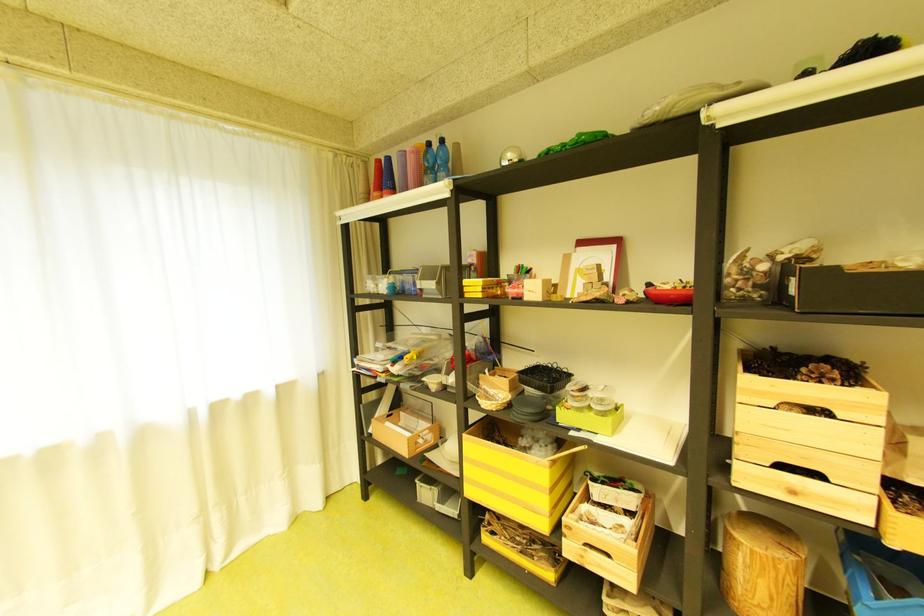
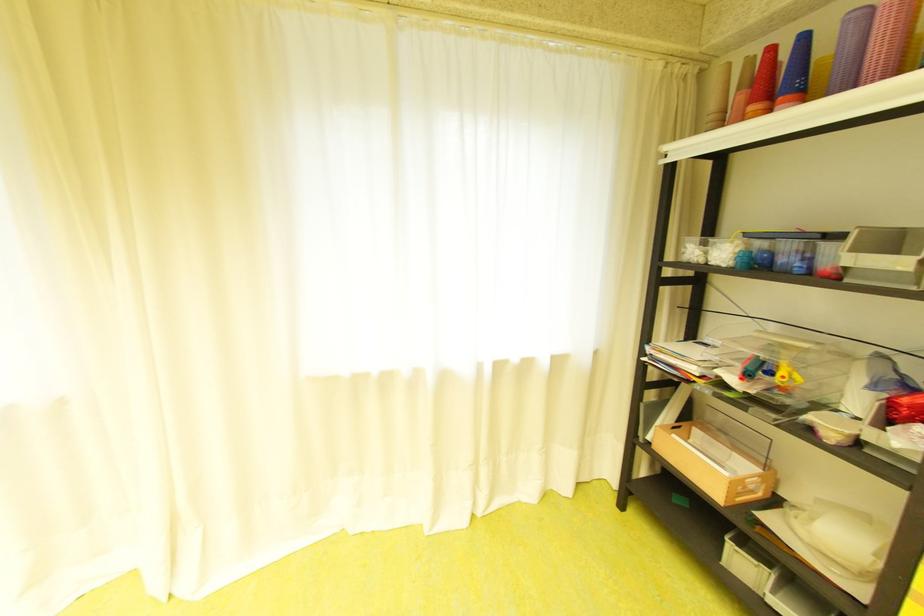
Question: The camera is either moving clockwise (left) or counter-clockwise (right) around the object. The first image is from the beginning of the video and the second image is from the end. Is the camera moving left or right when shooting the video?

Choices:
 (A) Left
 (B) Right

Answer: (B)